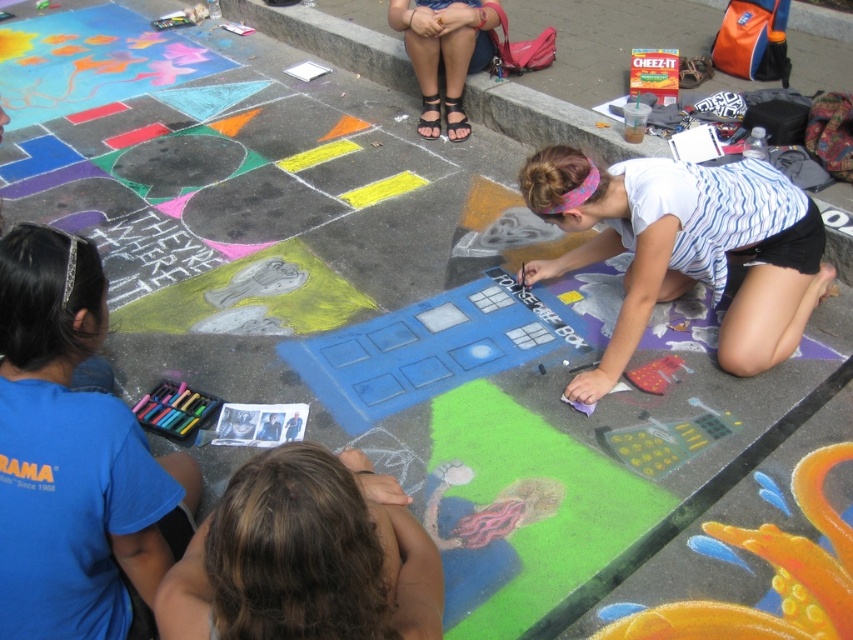
You are standing at the origin point of the coordinate system in the image. Which direction should you move to reach the blue fabric shirt at lower left?

The blue fabric shirt at lower left is located at coordinate point 0.714 on the x axis and 0.087 on the y axis. Since the origin is at the bottom left corner, moving towards positive x direction and slightly upwards along the y axis would reach it.

What is the exact coordinate of the brown hair at lower left?

The brown hair at lower left is located at coordinate point (x=305, y=556).